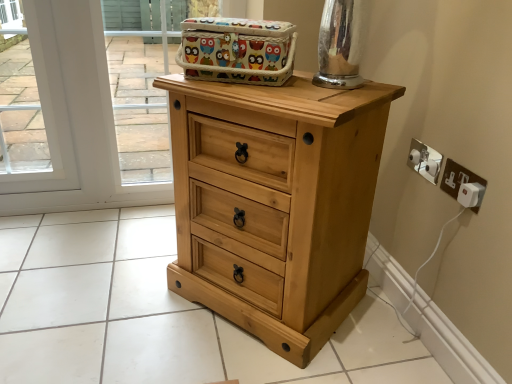
Find the location of a particular element. free spot to the left of natural wood chest of drawers at center is located at coordinates (125, 292).